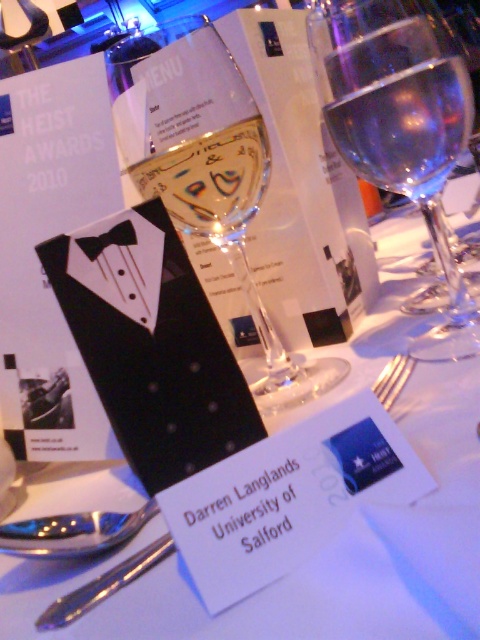
Is point (109, 584) positioned before point (412, 364)?

Yes, it is.

Between polished metal spoon at lower left and silver metallic fork at center, which one has less height?

polished metal spoon at lower left

At what (x,y) coordinates should I click in order to perform the action: click on polished metal spoon at lower left. Please return your answer as a coordinate pair (x, y). The image size is (480, 640). Looking at the image, I should click on (104, 586).

In order to click on polished metal spoon at lower left in this screenshot , I will do click(104, 586).

Between transparent glass wine glass at center and shiny metallic spoon at lower left, which one appears on the left side from the viewer's perspective?

shiny metallic spoon at lower left

Does transparent glass wine glass at center appear on the left side of shiny metallic spoon at lower left?

In fact, transparent glass wine glass at center is to the right of shiny metallic spoon at lower left.

Find the location of a particular element. Image resolution: width=480 pixels, height=640 pixels. transparent glass wine glass at center is located at coordinates (205, 168).

Image resolution: width=480 pixels, height=640 pixels. I want to click on transparent glass wine glass at upper center, so click(x=399, y=124).

Who is positioned more to the left, transparent glass wine glass at upper center or shiny metallic spoon at lower left?

Positioned to the left is shiny metallic spoon at lower left.

Is point (362, 40) positioned in front of point (88, 538)?

No, (362, 40) is behind (88, 538).

You are a GUI agent. You are given a task and a screenshot of the screen. Output one action in this format:
    pyautogui.click(x=<x>, y=<y>)
    Task: Click on the transparent glass wine glass at upper center
    
    Given the screenshot: What is the action you would take?
    pyautogui.click(x=399, y=124)